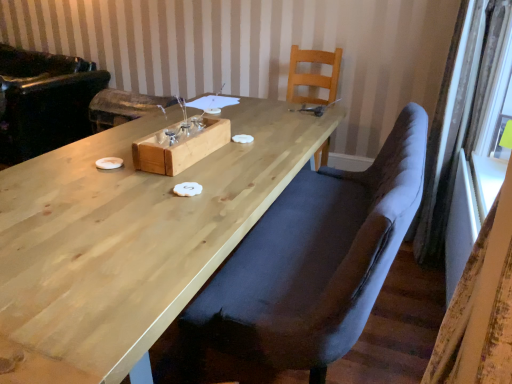
The height and width of the screenshot is (384, 512). I want to click on free point above natural wood tray at center (from a real-world perspective), so click(194, 127).